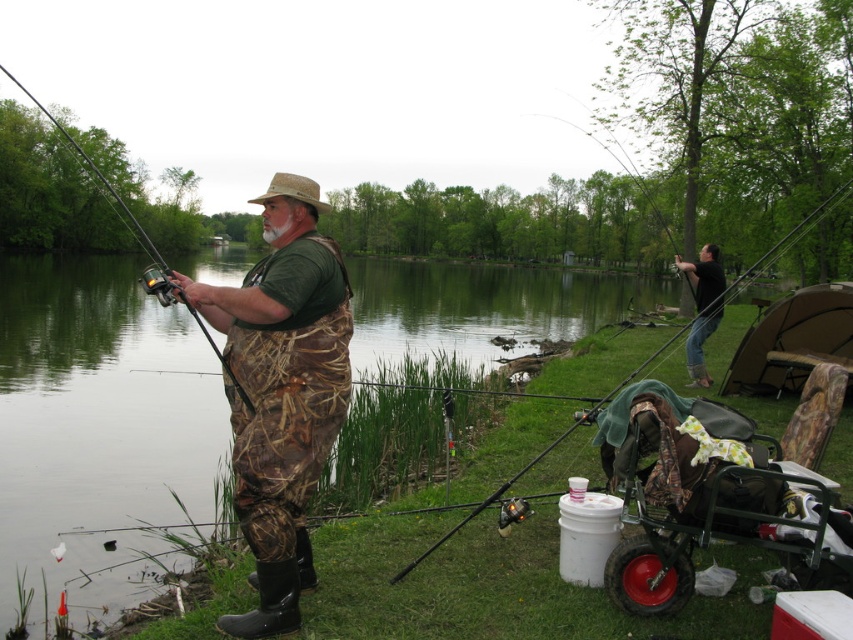
You are a drone operator tasked with capturing aerial footage of the dark green shirt at right and the matte black fishing pole at left in the fishing scene. The drone has a maximum operational radius of 30 meters from the operator. Can the drone capture both objects within its range without moving the drone?

The distance between the dark green shirt at right and the matte black fishing pole at left is 27.14 meters. Since the drone has a maximum operational radius of 30 meters, it can capture both objects within its range without moving the drone as the distance is within the limit.

You are a photographer trying to capture the dark green shirt at right and the matte black fishing pole at left in the same frame. Can you see both objects clearly without moving your camera position?

The matte black fishing pole at left is behind the dark green shirt at right, so the dark green shirt at right may block the view of the matte black fishing pole at left, making it difficult to see both clearly in the same frame without moving the camera.